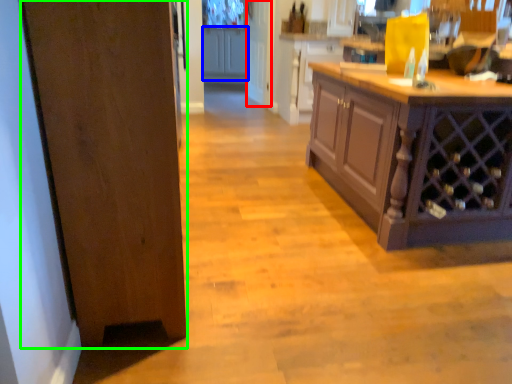
Question: Considering the real-world distances, which object is closest to glass door (highlighted by a red box)? cabinetry (highlighted by a blue box) or door (highlighted by a green box).

Choices:
 (A) cabinetry
 (B) door

Answer: (A)